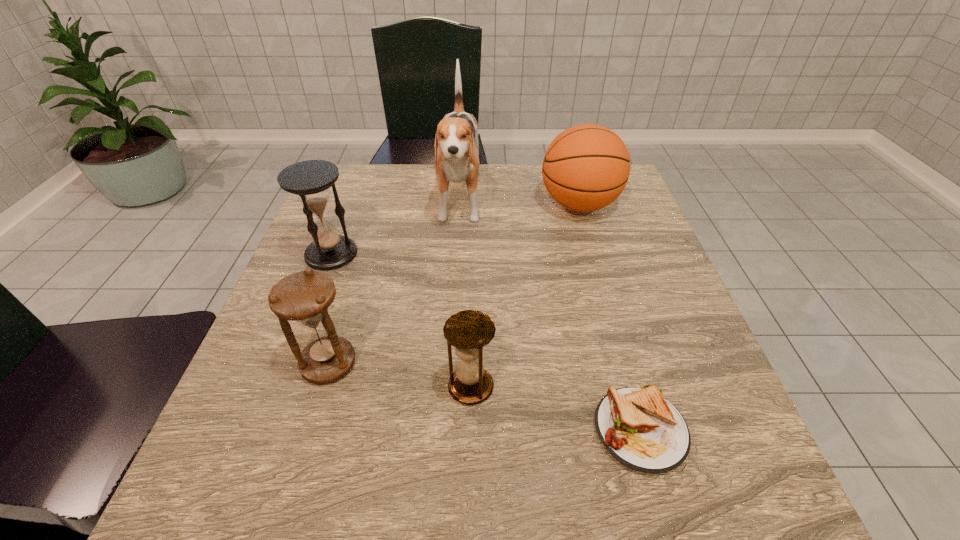
Image resolution: width=960 pixels, height=540 pixels. In order to click on free space at the left edge of the desktop in this screenshot , I will do `click(276, 316)`.

You are a GUI agent. You are given a task and a screenshot of the screen. Output one action in this format:
    pyautogui.click(x=<x>, y=<y>)
    Task: Click on the vacant space at the right edge
    This screenshot has height=540, width=960.
    Given the screenshot: What is the action you would take?
    pyautogui.click(x=625, y=262)

Where is `free space at the near left corner of the desktop`? The width and height of the screenshot is (960, 540). free space at the near left corner of the desktop is located at coordinates (228, 517).

This screenshot has height=540, width=960. I want to click on free region at the far right corner, so click(x=631, y=201).

This screenshot has width=960, height=540. Identify the location of blank area at the near right corner. (663, 475).

Locate an element on the screen. vacant space in between the fifth tallest object and the basketball is located at coordinates (525, 296).

Identify the location of free point between the farthest hourglass and the puppy. (396, 228).

In order to click on free space between the shortest object and the puppy in this screenshot , I will do `click(550, 316)`.

I want to click on empty space that is in between the puppy and the farthest hourglass, so click(396, 228).

I want to click on vacant area that lies between the basketball and the tallest object, so click(519, 203).